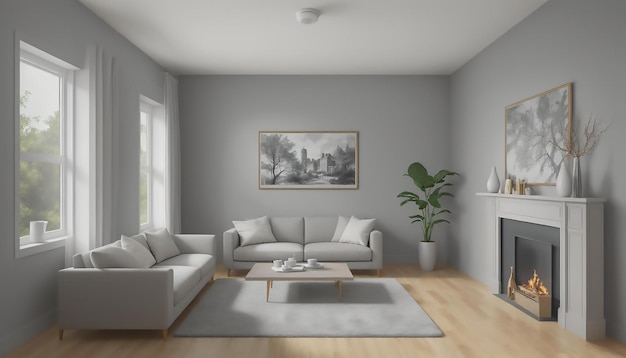
This screenshot has height=358, width=626. What are the coordinates of `picture` in the screenshot? It's located at (327, 149).